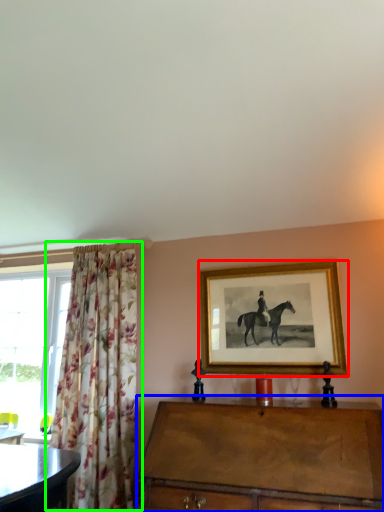
Question: Which is farther away from picture frame (highlighted by a red box)? chest of drawers (highlighted by a blue box) or curtain (highlighted by a green box)?

Choices:
 (A) chest of drawers
 (B) curtain

Answer: (B)